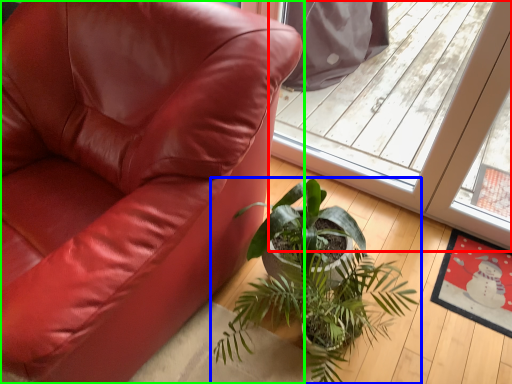
Question: Estimate the real-world distances between objects in this image. Which object is closer to screen door (highlighted by a red box), houseplant (highlighted by a blue box) or chair (highlighted by a green box)?

Choices:
 (A) houseplant
 (B) chair

Answer: (A)